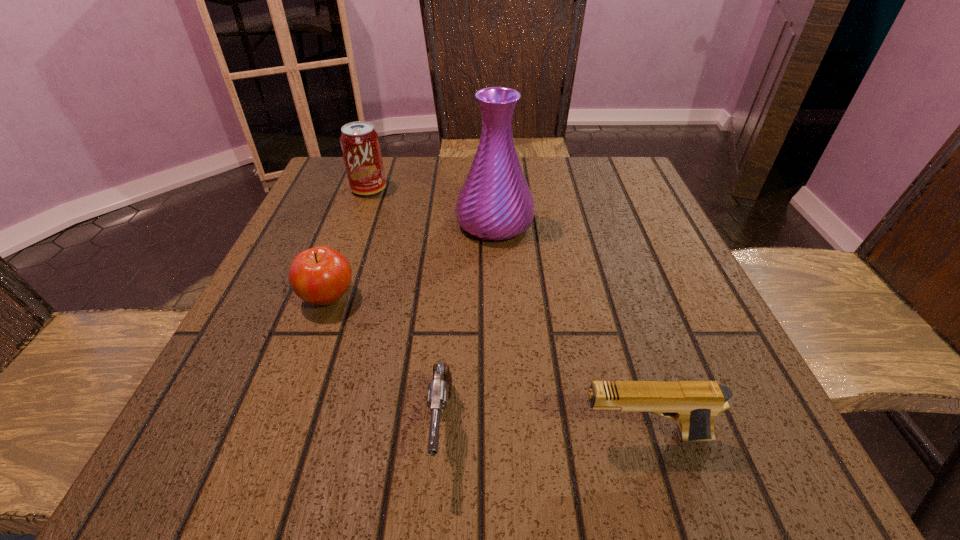
You are a GUI agent. You are given a task and a screenshot of the screen. Output one action in this format:
    pyautogui.click(x=<x>, y=<y>)
    Task: Click on the vacant region located 0.240m at the barrel of the right pistol
    The height and width of the screenshot is (540, 960).
    Given the screenshot: What is the action you would take?
    pyautogui.click(x=397, y=436)

Identify the location of vacant space located 0.290m at the barrel of the right pistol. The image size is (960, 540). (359, 436).

Find the location of a particular element. The width and height of the screenshot is (960, 540). blank space located 0.110m on the right of the apple is located at coordinates (420, 298).

At what (x,y) coordinates should I click in order to perform the action: click on vase situated at the far edge. Please return your answer as a coordinate pair (x, y). Looking at the image, I should click on point(495,203).

Where is `soda can that is at the far edge`? The width and height of the screenshot is (960, 540). soda can that is at the far edge is located at coordinates (360, 144).

Where is `soda can present at the left edge`? soda can present at the left edge is located at coordinates (360, 144).

Locate an element on the screen. This screenshot has height=540, width=960. apple located in the left edge section of the desktop is located at coordinates (321, 275).

This screenshot has width=960, height=540. What are the coordinates of `object that is at the right edge` in the screenshot? It's located at (693, 404).

The width and height of the screenshot is (960, 540). Identify the location of object that is at the far left corner. (360, 144).

Image resolution: width=960 pixels, height=540 pixels. Find the location of `object that is positioned at the near right corner`. object that is positioned at the near right corner is located at coordinates (693, 404).